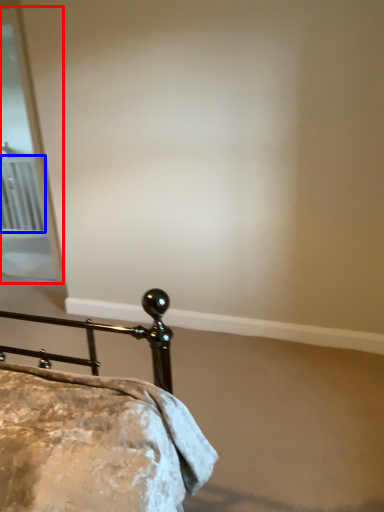
Question: Which object appears closest to the camera in this image, screen door (highlighted by a red box) or radiator (highlighted by a blue box)?

Choices:
 (A) screen door
 (B) radiator

Answer: (A)